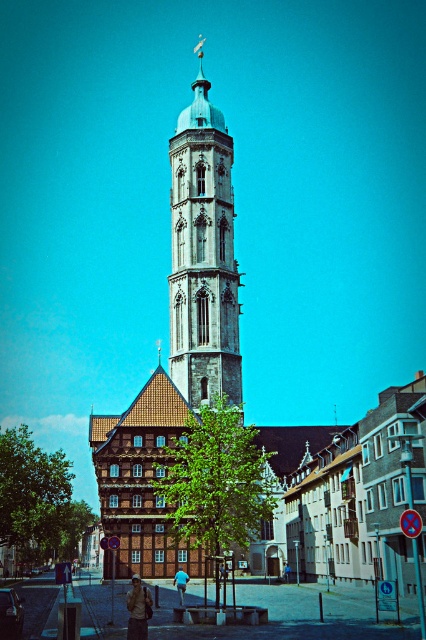
Question: Which object appears closest to the camera in this image?

Choices:
 (A) green leafy tree at center
 (B) blue stone tower at center

Answer: (A)

Question: Does green leafy tree at lower left appear on the right side of blue denim jacket at center?

Choices:
 (A) no
 (B) yes

Answer: (A)

Question: Is green leafy tree at center above green leafy tree at lower left?

Choices:
 (A) no
 (B) yes

Answer: (B)

Question: Based on their relative distances, which object is nearer to the camouflage jacket at lower center?

Choices:
 (A) blue denim jacket at center
 (B) blue stone tower at center
 (C) green leafy tree at lower left
 (D) green leafy tree at center

Answer: (D)

Question: From the image, what is the correct spatial relationship of green leafy tree at center in relation to blue denim jacket at center?

Choices:
 (A) left
 (B) right

Answer: (A)

Question: Which of the following is the closest to the observer?

Choices:
 (A) (187, 579)
 (B) (290, 566)
 (C) (213, 435)

Answer: (A)